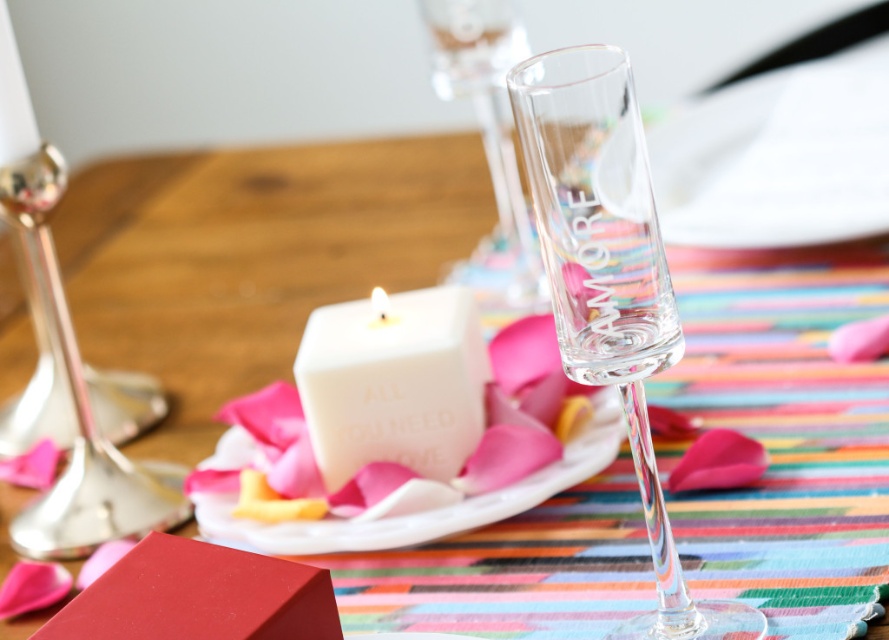
Is the position of transparent glass flute at center less distant than that of white matte plate at center?

Yes, it is.

Which is in front, point (586, 60) or point (502, 358)?

Positioned in front is point (586, 60).

Where is `transparent glass flute at center`? Image resolution: width=889 pixels, height=640 pixels. transparent glass flute at center is located at coordinates (611, 284).

The image size is (889, 640). In order to click on transparent glass flute at center in this screenshot , I will do `click(611, 284)`.

Locate an element on the screen. This screenshot has height=640, width=889. transparent glass flute at center is located at coordinates (611, 284).

Can you confirm if white matte plate at center is smaller than white matte cube at center?

Incorrect, white matte plate at center is not smaller in size than white matte cube at center.

Is point (475, 470) farther from viewer compared to point (337, 429)?

No, it is in front of (337, 429).

Image resolution: width=889 pixels, height=640 pixels. Identify the location of white matte plate at center. (404, 465).